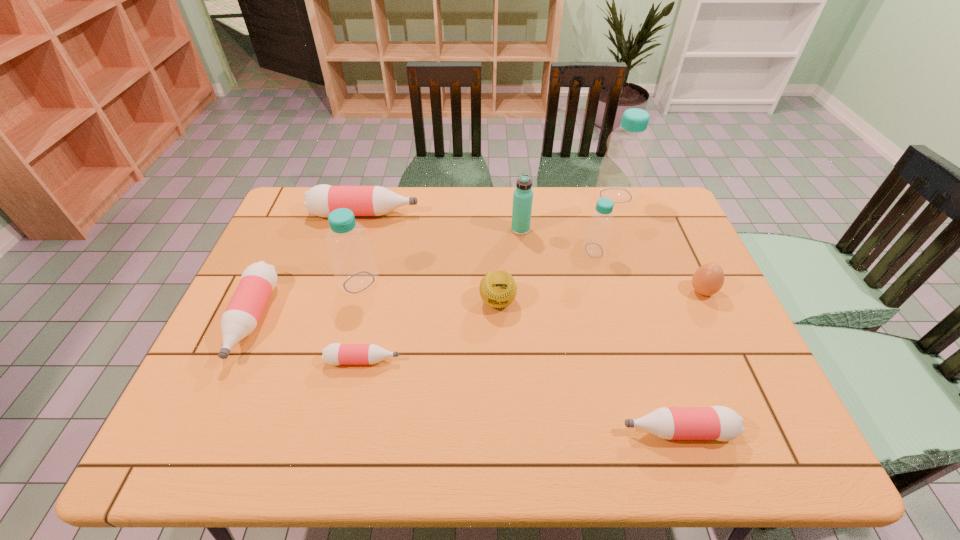
Locate an element on the screen. This screenshot has width=960, height=540. free region located on the right of the nearest blue bottle is located at coordinates (407, 282).

This screenshot has width=960, height=540. I want to click on vacant space located on the front of the aqua thermos bottle, so click(x=526, y=284).

Identify the location of vacant space located 0.140m on the back of the second blue bottle from right to left. The width and height of the screenshot is (960, 540). (584, 213).

This screenshot has height=540, width=960. I want to click on vacant space situated 0.320m with the cap open on the farthest pink bottle, so click(516, 214).

Image resolution: width=960 pixels, height=540 pixels. Find the location of `free point located on the back of the rightmost object`. free point located on the back of the rightmost object is located at coordinates (677, 237).

In order to click on free spot located 0.100m on the logo side of the fifth object from left to right in this screenshot , I will do `click(499, 347)`.

At what (x,y) coordinates should I click in order to perform the action: click on vacant space situated 0.050m with the cap open on the third smallest pink bottle. Please return your answer as a coordinate pair (x, y). Looking at the image, I should click on (221, 387).

At what (x,y) coordinates should I click in order to perform the action: click on free region located 0.220m with the cap open on the rightmost pink bottle. Please return your answer as a coordinate pair (x, y). This screenshot has height=540, width=960. Looking at the image, I should click on (518, 431).

The width and height of the screenshot is (960, 540). I want to click on vacant space situated with the cap open on the rightmost pink bottle, so click(x=514, y=431).

This screenshot has width=960, height=540. I want to click on free space located with the cap open on the rightmost pink bottle, so click(x=584, y=431).